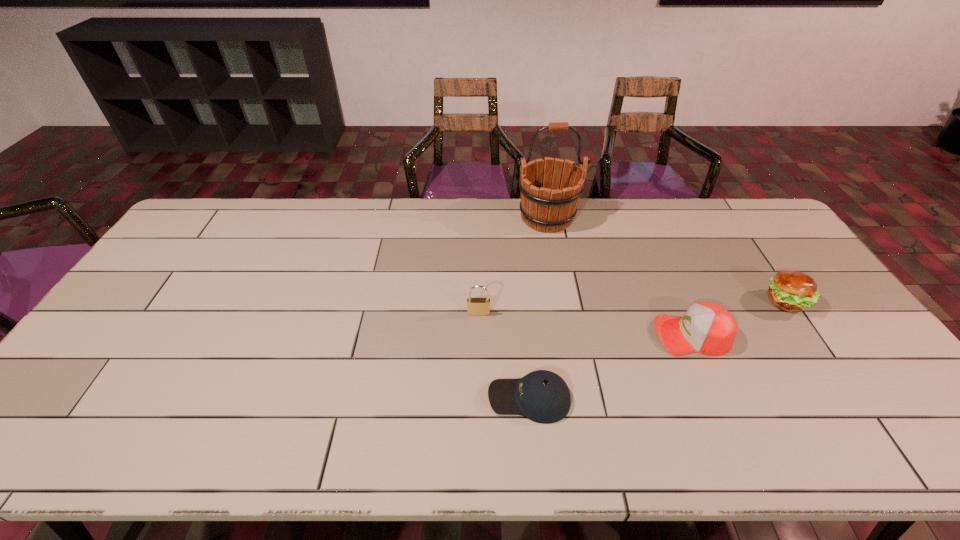
This screenshot has height=540, width=960. In order to click on vacant area at the far edge in this screenshot , I will do `click(659, 199)`.

Identify the location of vacant space at the near edge of the desktop. The width and height of the screenshot is (960, 540). (599, 440).

In the image, there is a desktop. In order to click on vacant space at the left edge in this screenshot , I will do `click(194, 254)`.

This screenshot has width=960, height=540. I want to click on vacant area at the right edge, so click(796, 319).

Where is `free space at the far left corner of the desktop`? free space at the far left corner of the desktop is located at coordinates (219, 205).

Image resolution: width=960 pixels, height=540 pixels. Find the location of `vacant position at the near left corner of the desktop`. vacant position at the near left corner of the desktop is located at coordinates (60, 438).

Image resolution: width=960 pixels, height=540 pixels. In the image, there is a desktop. In order to click on vacant space at the far right corner in this screenshot , I will do `click(743, 199)`.

Identify the location of vacant region between the fourth object from left to right and the padlock. (586, 324).

This screenshot has height=540, width=960. Identify the location of free space between the padlock and the farthest object. (513, 265).

At what (x,y) coordinates should I click in order to perform the action: click on vacant region between the hamburger and the second object from right to left. Please return your answer as a coordinate pair (x, y). The width and height of the screenshot is (960, 540). Looking at the image, I should click on (739, 318).